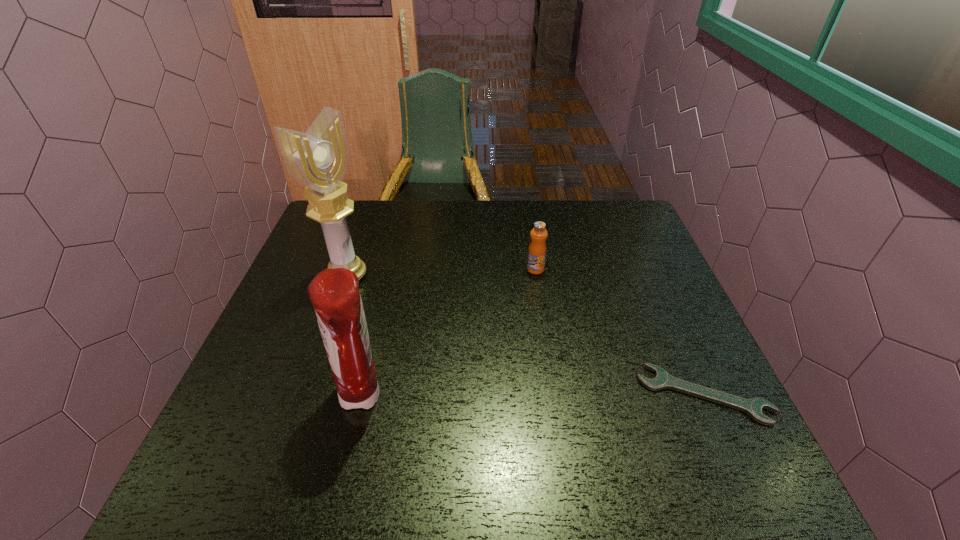
Where is `unoccupied position between the shortest object and the condiment`? unoccupied position between the shortest object and the condiment is located at coordinates (533, 395).

Where is `vacant space that's between the wrench and the leftmost object`? vacant space that's between the wrench and the leftmost object is located at coordinates (525, 335).

Find the location of `free area in between the second object from right to left and the wrench`. free area in between the second object from right to left and the wrench is located at coordinates (619, 332).

You are a GUI agent. You are given a task and a screenshot of the screen. Output one action in this format:
    pyautogui.click(x=<x>, y=<y>)
    Task: Click on the free space between the shortest object and the third tallest object
    The width and height of the screenshot is (960, 540).
    Given the screenshot: What is the action you would take?
    pyautogui.click(x=619, y=332)

Identify the location of free area in between the shortest object and the award. (525, 335).

Locate an element on the screen. The image size is (960, 540). free area in between the second shortest object and the third shortest object is located at coordinates (449, 333).

Where is `free spot between the wrench and the award`? free spot between the wrench and the award is located at coordinates (525, 335).

At what (x,y) coordinates should I click in order to perform the action: click on vacant space that is in between the shortest object and the third object from right to left. Please return your answer as a coordinate pair (x, y). Looking at the image, I should click on (533, 395).

Point out which object is positioned as the nearest to the wrench. Please provide its 2D coordinates. Your answer should be formatted as a tuple, i.e. [(x, y)], where the tuple contains the x and y coordinates of a point satisfying the conditions above.

[(537, 249)]

Select which object is the third closest to the third tallest object. Please provide its 2D coordinates. Your answer should be formatted as a tuple, i.e. [(x, y)], where the tuple contains the x and y coordinates of a point satisfying the conditions above.

[(334, 294)]